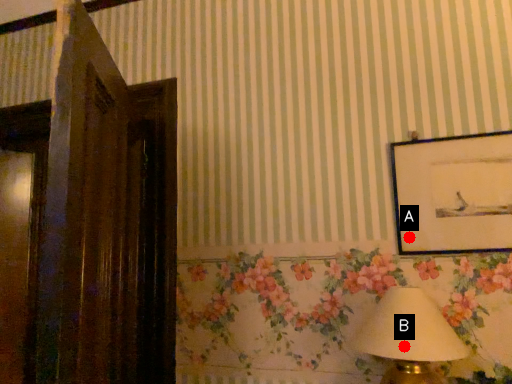
Question: Two points are circled on the image, labeled by A and B beside each circle. Among these points, which one is nearest to the camera?

Choices:
 (A) A is closer
 (B) B is closer

Answer: (B)